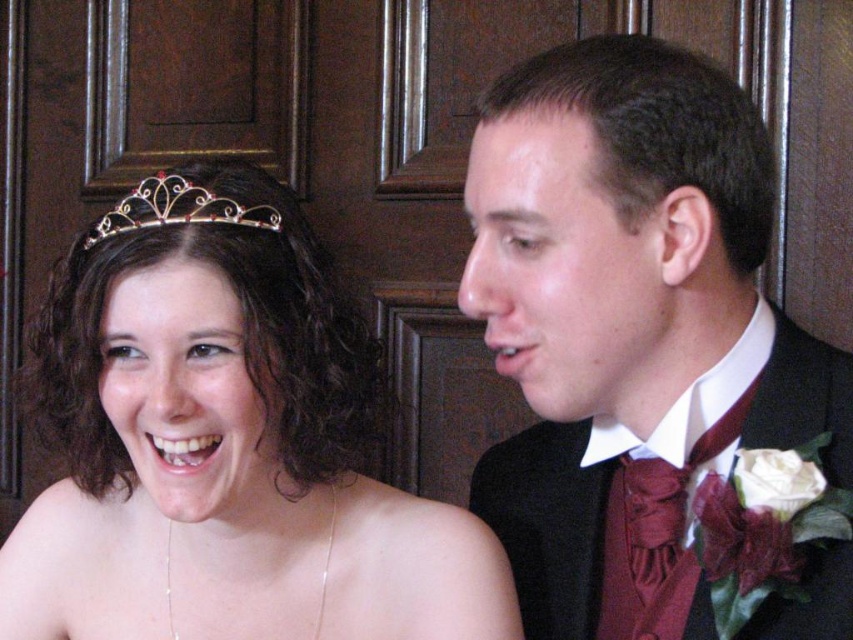
Consider the image. Is matte gold tiara at upper left bigger than silver/golden metallic tiara at upper left?

Indeed, matte gold tiara at upper left has a larger size compared to silver/golden metallic tiara at upper left.

Does point (35, 548) come in front of point (198, 205)?

No, (35, 548) is further to viewer.

The image size is (853, 640). Find the location of `matte gold tiara at upper left`. matte gold tiara at upper left is located at coordinates (225, 444).

Consider the image. Is matte black suit at right to the left of matte gold tiara at upper left from the viewer's perspective?

No, matte black suit at right is not to the left of matte gold tiara at upper left.

Is point (521, 93) positioned in front of point (329, 481)?

Yes, point (521, 93) is in front of point (329, 481).

Is point (697, 481) positioned behind point (108, 584)?

No, (697, 481) is closer to viewer.

Where is `matte black suit at right`? The width and height of the screenshot is (853, 640). matte black suit at right is located at coordinates (651, 358).

Is matte black suit at right taller than silver/golden metallic tiara at upper left?

Yes, matte black suit at right is taller than silver/golden metallic tiara at upper left.

Does matte black suit at right appear on the left side of silver/golden metallic tiara at upper left?

Incorrect, matte black suit at right is not on the left side of silver/golden metallic tiara at upper left.

Which is in front, point (738, 339) or point (136, 225)?

Positioned in front is point (738, 339).

The width and height of the screenshot is (853, 640). Identify the location of matte black suit at right. (651, 358).